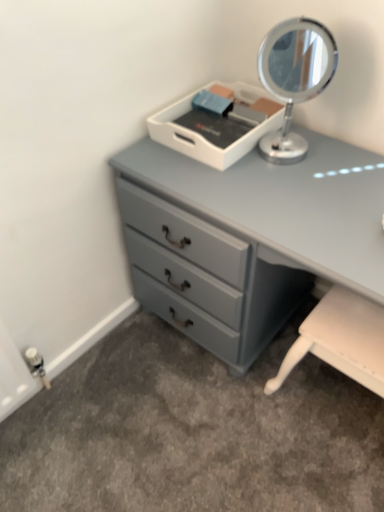
Locate an element on the screen. free spot above matte gray dresser at center (from a real-world perspective) is located at coordinates (284, 183).